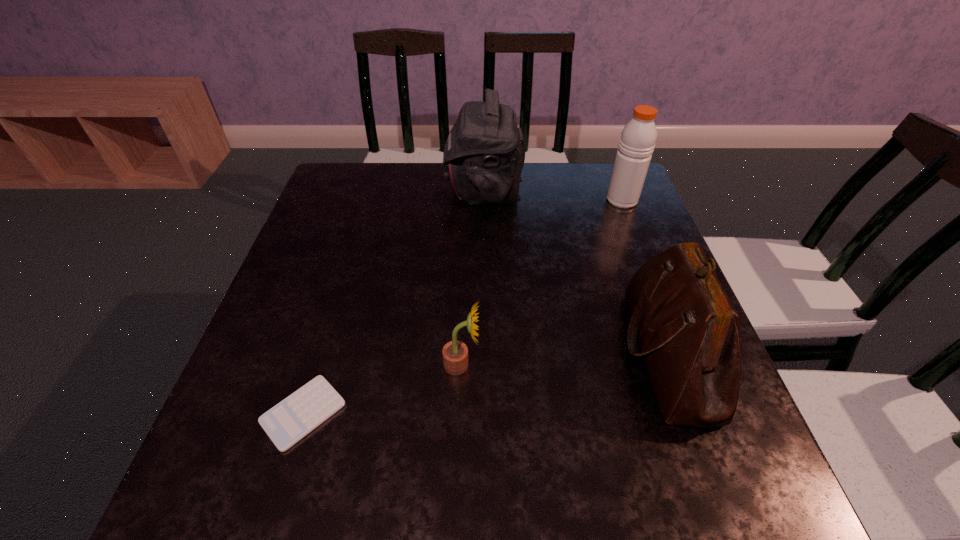
What are the coordinates of `the farther shoulder bag` in the screenshot? It's located at (484, 154).

Locate an element on the screen. This screenshot has width=960, height=540. shaker is located at coordinates (637, 142).

I want to click on the nearer shoulder bag, so click(689, 333).

Identify the location of the second shortest object. (455, 353).

Locate an element on the screen. The image size is (960, 540). the leftmost object is located at coordinates (293, 418).

At what (x,y) coordinates should I click in order to perform the action: click on the shortest object. Please return your answer as a coordinate pair (x, y). The width and height of the screenshot is (960, 540). Looking at the image, I should click on (293, 418).

The image size is (960, 540). Find the location of `free space located on the open flap of the left shoulder bag`. free space located on the open flap of the left shoulder bag is located at coordinates (342, 189).

The width and height of the screenshot is (960, 540). I want to click on free space located 0.240m on the open flap of the left shoulder bag, so click(362, 189).

Where is `vacant space located on the open flap of the left shoulder bag`? This screenshot has width=960, height=540. vacant space located on the open flap of the left shoulder bag is located at coordinates (379, 189).

Identify the location of vacant area situated 0.200m on the left of the shaker. (536, 200).